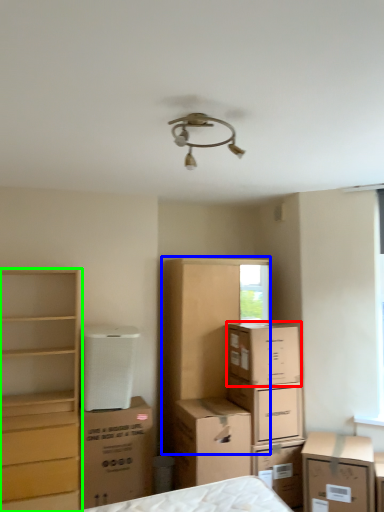
Question: Considering the real-world distances, which object is farthest from cardboard box (highlighted by a red box)? dresser (highlighted by a blue box) or chest of drawers (highlighted by a green box)?

Choices:
 (A) dresser
 (B) chest of drawers

Answer: (B)